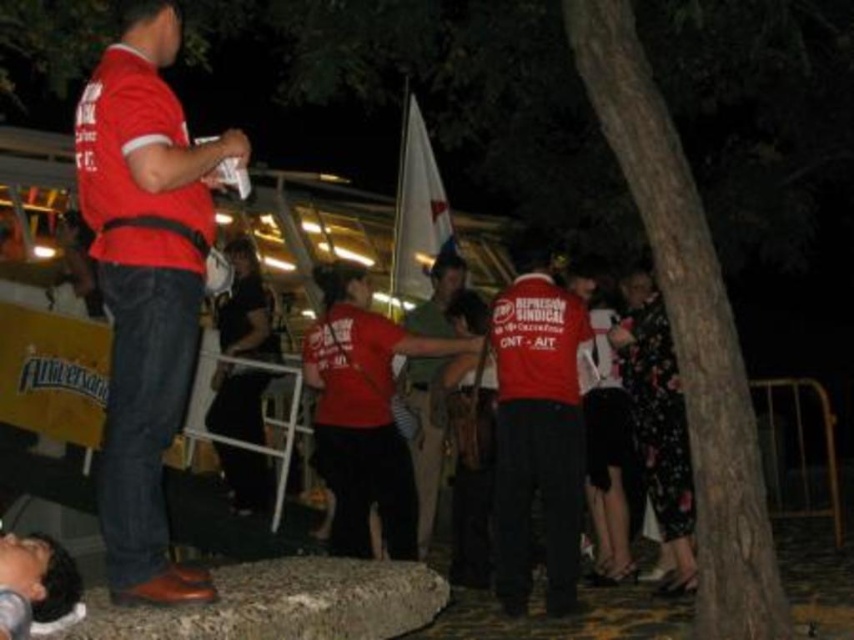
You are a photographer at the event and want to capture both the matte red shirt at left and the matte red shirt at center in a single photo. Which person should be closer to the camera to ensure both are fully visible?

The matte red shirt at left is positioned over the matte red shirt at center, so the person in the matte red shirt at left should be closer to the camera to ensure both are fully visible without one blocking the other.